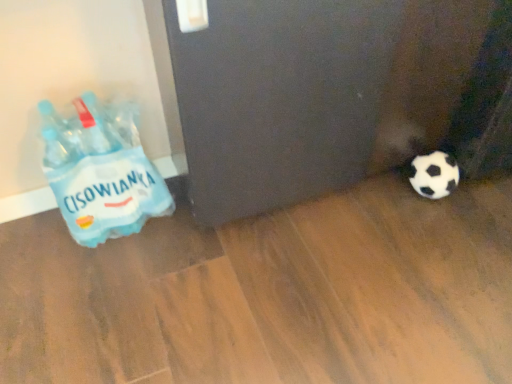
Locate an element on the screen. This screenshot has height=384, width=512. free region on the left part of blue plastic bottle at left is located at coordinates (34, 238).